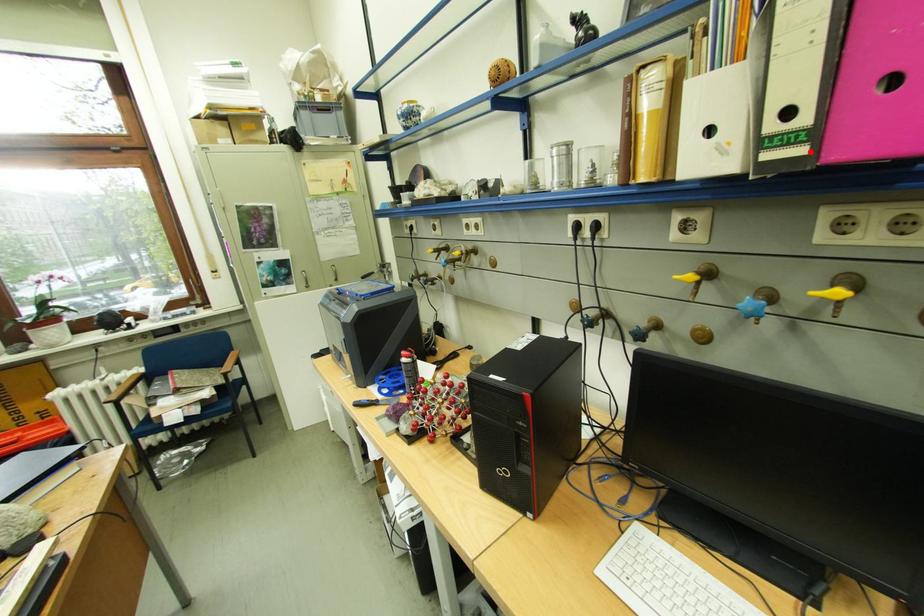
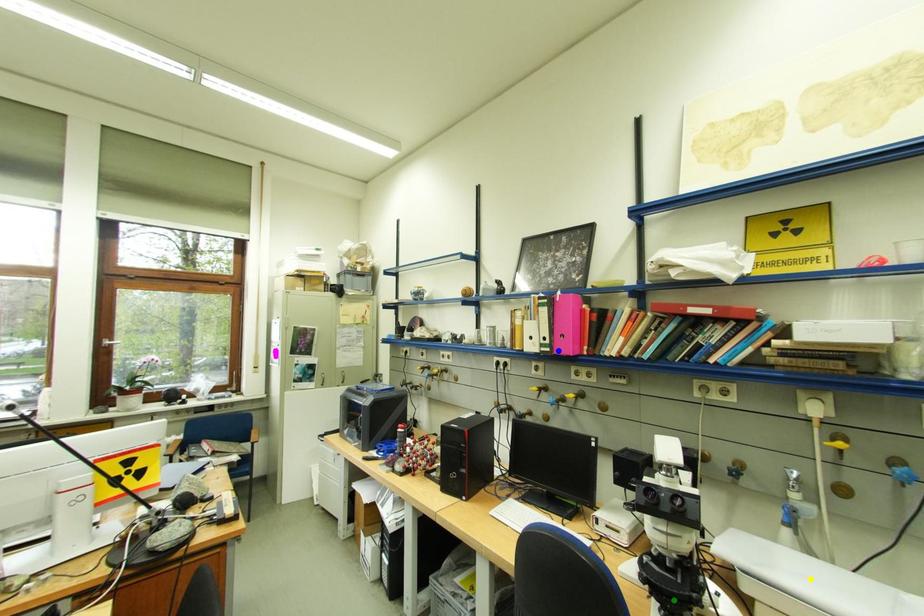
Question: I am providing you with two images of the same scene from different viewpoints. A red point is marked on the first image. You are given multiple points on the second image. Which point in image 2 represents the same 3d spot as the red point in image 1?

Choices:
 (A) blue point
 (B) yellow point
 (C) green point

Answer: (A)